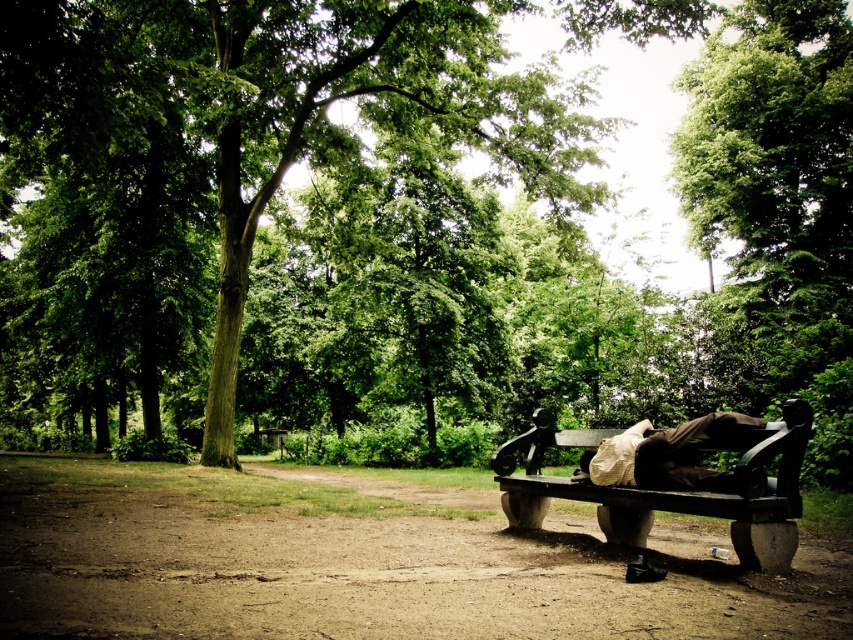
You are a photographer wanting to capture the green leafy tree at center and the brown fabric bag at lower right in the same frame. Which object should you focus on first to ensure both are in focus?

The green leafy tree at center is further to the viewer than the brown fabric bag at lower right, so you should focus on the green leafy tree at center first to ensure both are in focus.

You are a hiker who wants to take a photo of the green leafy tree at center and the brown fabric bag at lower right. Which object should you focus on first if you want to capture both in the same frame without moving the camera?

The green leafy tree at center is taller than the brown fabric bag at lower right, so you should focus on the green leafy tree at center first to ensure it fits entirely within the frame.